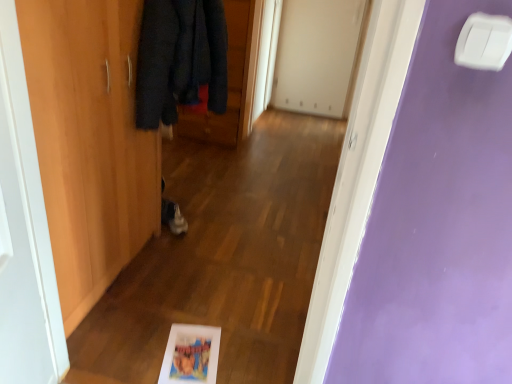
What are the coordinates of `free space to the back side of matte plastic picture frame at lower center` in the screenshot? It's located at (209, 310).